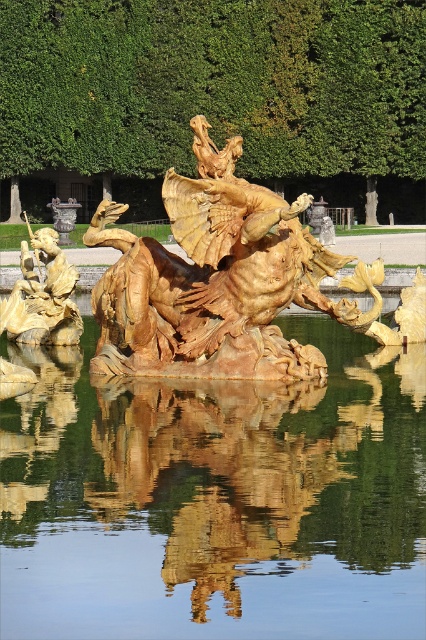
You are a landscape architect designing a pathway that needs to pass between the green leafy hedge at upper center and the gold polished statue at left. The pathway must be at least 1 meter wide. Can you confirm if there is enough space between them for the pathway?

The green leafy hedge at upper center is 91.10 meters from the gold polished statue at left, so yes, there is more than enough space to create a 1 meter wide pathway between them.

You are a visitor at the garden and want to take a photo of the gold reflective water at center and the gold polished statue at left. Which object appears taller in the photo?

The gold polished statue at left is taller than the gold reflective water at center.

You are a landscape architect designing a pathway that must pass between the green leafy hedge at upper center and the gold polished statue at left. Considering their widths, which side of the pathway should you widen to ensure there is enough space for visitors to walk comfortably?

The green leafy hedge at upper center is wider than the gold polished statue at left, so you should widen the side of the pathway near the gold polished statue at left to ensure sufficient space for visitors.